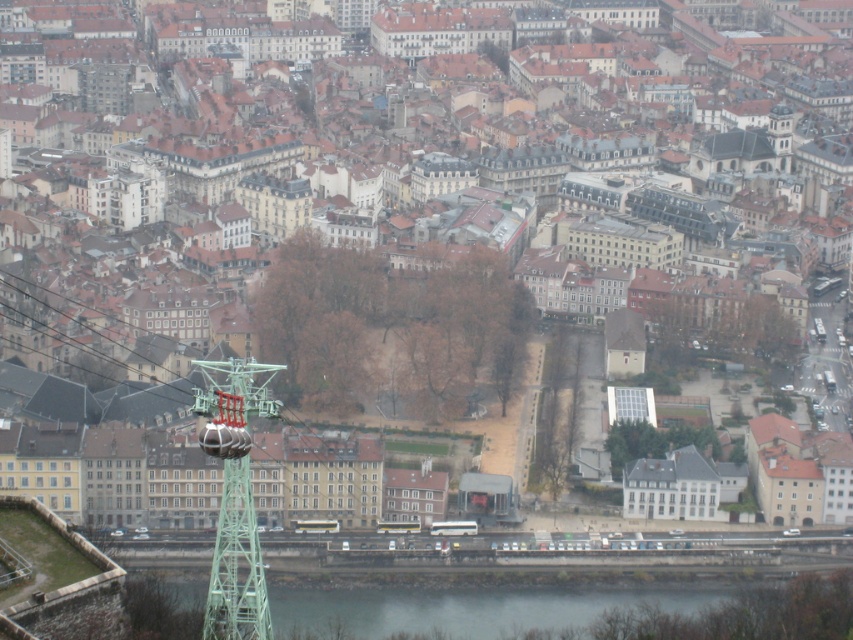
Looking at this image, is gray concrete river at lower center closer to the viewer compared to green metallic cable car tower at left?

No, it is not.

Can you confirm if gray concrete river at lower center is wider than green metallic cable car tower at left?

Indeed, gray concrete river at lower center has a greater width compared to green metallic cable car tower at left.

Find the location of a particular element. gray concrete river at lower center is located at coordinates (463, 609).

The image size is (853, 640). What are the coordinates of `gray concrete river at lower center` in the screenshot? It's located at (463, 609).